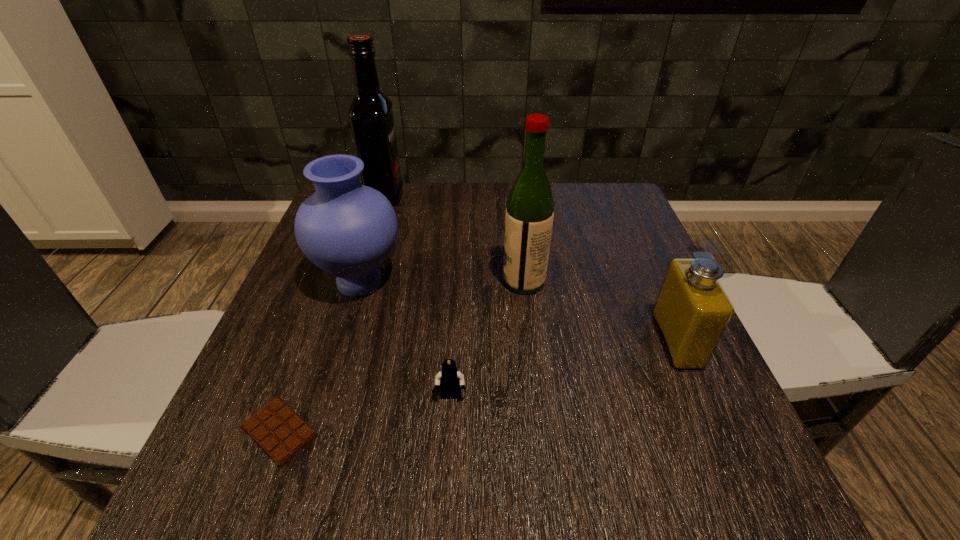
Where is `vacant space at the near left corner of the desktop`? vacant space at the near left corner of the desktop is located at coordinates point(305,498).

The height and width of the screenshot is (540, 960). Find the location of `free region at the far right corner of the desktop`. free region at the far right corner of the desktop is located at coordinates (603, 187).

Where is `vacant space at the near right corner`? The image size is (960, 540). vacant space at the near right corner is located at coordinates (680, 463).

Where is `vacant space in between the Lego and the candy bar`? The height and width of the screenshot is (540, 960). vacant space in between the Lego and the candy bar is located at coordinates (366, 414).

The image size is (960, 540). I want to click on empty space that is in between the right liquor and the left liquor, so click(454, 239).

At what (x,y) coordinates should I click in order to perform the action: click on empty space between the third shortest object and the Lego. Please return your answer as a coordinate pair (x, y). Looking at the image, I should click on (564, 369).

In order to click on vacant space that is in between the fourth object from left to right and the left liquor in this screenshot , I will do [418, 296].

This screenshot has height=540, width=960. In order to click on blank region between the second shortest object and the left liquor in this screenshot , I will do `click(418, 296)`.

The width and height of the screenshot is (960, 540). I want to click on free space between the fifth tallest object and the rightmost object, so click(x=564, y=369).

Where is `free space between the fourth farthest object and the vase`? The width and height of the screenshot is (960, 540). free space between the fourth farthest object and the vase is located at coordinates (518, 312).